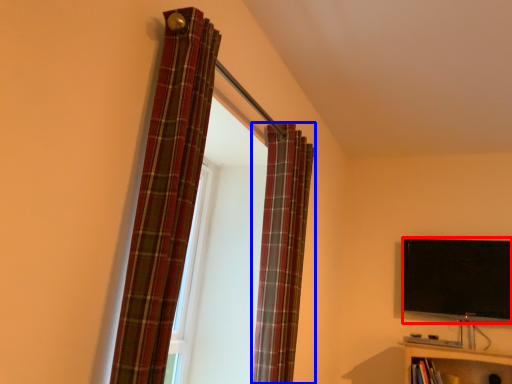
Question: Which object appears farthest to the camera in this image, television (highlighted by a red box) or curtain (highlighted by a blue box)?

Choices:
 (A) television
 (B) curtain

Answer: (A)